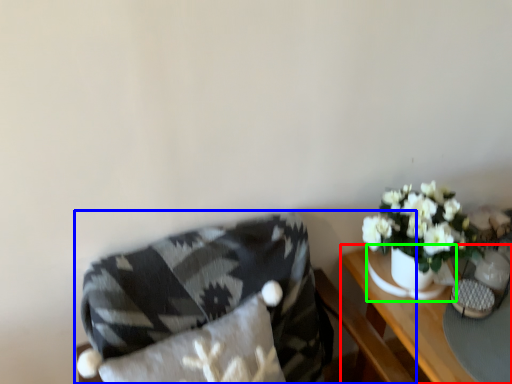
Question: Which object is positioned closest to table (highlighted by a red box)? Select from chair (highlighted by a blue box) and vase (highlighted by a green box).

Choices:
 (A) chair
 (B) vase

Answer: (B)